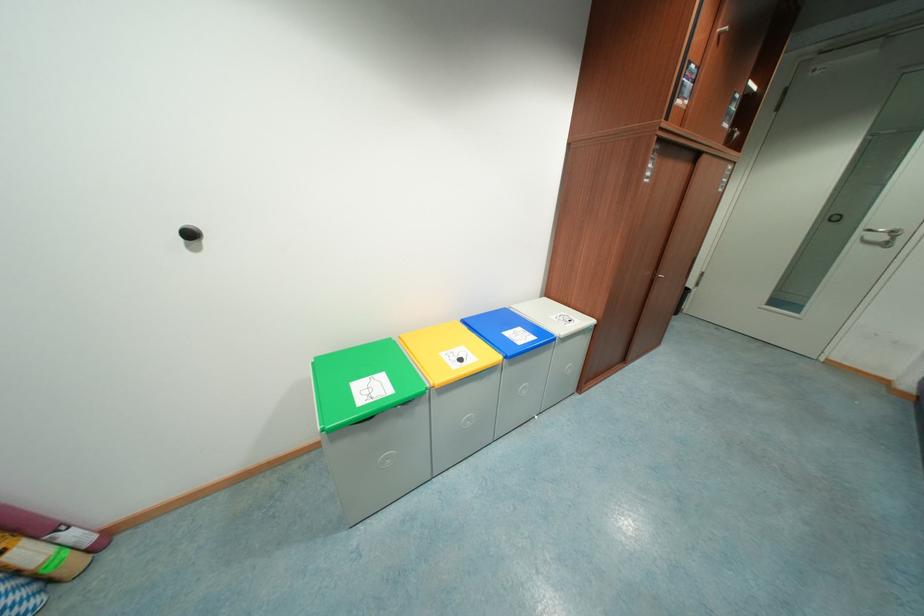
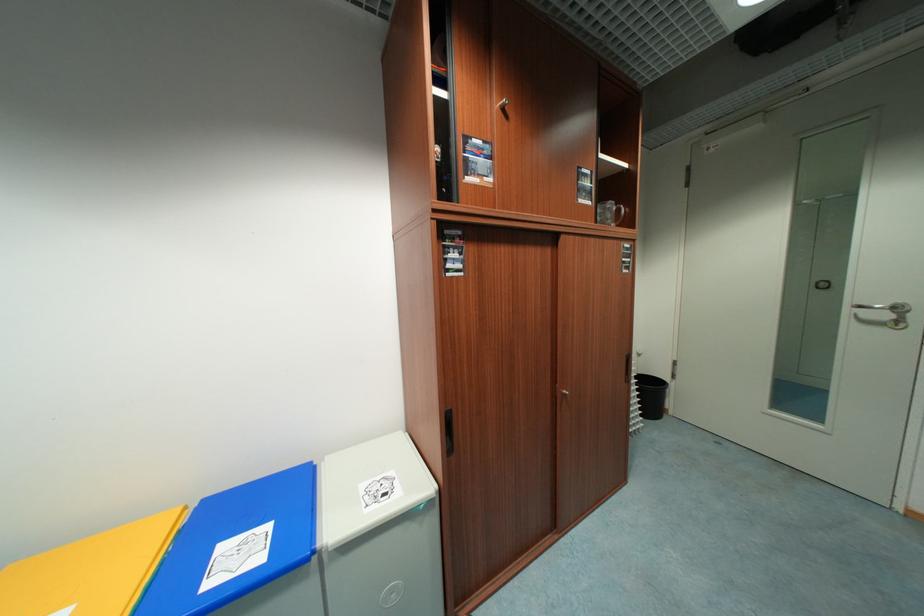
In a continuous first-person perspective shot, in which direction is the camera moving?

The cameraman moved toward right, forward.